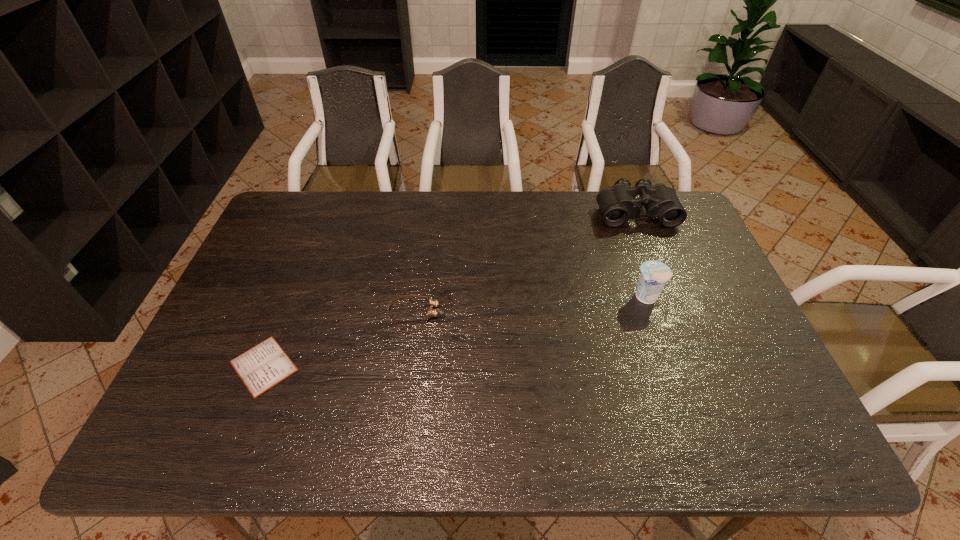
You are a GUI agent. You are given a task and a screenshot of the screen. Output one action in this format:
    pyautogui.click(x=<x>, y=<y>)
    Task: Click on the farthest object
    The image size is (960, 540).
    Given the screenshot: What is the action you would take?
    tap(617, 204)

The image size is (960, 540). In order to click on yogurt in this screenshot , I will do `click(654, 274)`.

You are a GUI agent. You are given a task and a screenshot of the screen. Output one action in this format:
    pyautogui.click(x=<x>, y=<y>)
    Task: Click on the goggles
    
    Given the screenshot: What is the action you would take?
    pyautogui.click(x=434, y=303)

At what (x,y) coordinates should I click in order to perform the action: click on the second object from left to right. Please return your answer as a coordinate pair (x, y). The height and width of the screenshot is (540, 960). Looking at the image, I should click on (434, 303).

Locate an element on the screen. the nearest object is located at coordinates (260, 368).

At what (x,y) coordinates should I click in order to perform the action: click on the shortest object. Please return your answer as a coordinate pair (x, y). Looking at the image, I should click on (260, 368).

Where is `vacant region located at the eyepieces of the farthest object`? vacant region located at the eyepieces of the farthest object is located at coordinates (646, 240).

This screenshot has height=540, width=960. In order to click on free space located 0.150m on the front of the yogurt in this screenshot , I will do `click(666, 354)`.

This screenshot has height=540, width=960. Identify the location of vacant space positioned 0.280m on the front lenses and sides of the second shortest object. pyautogui.click(x=546, y=312).

The image size is (960, 540). I want to click on free spot located on the right of the leftmost object, so click(384, 366).